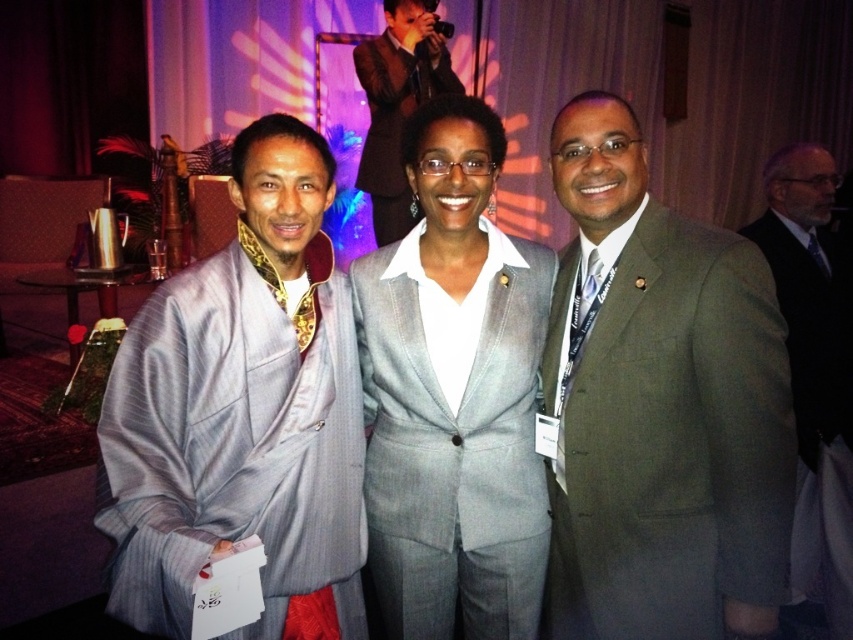
Question: Does silky gray robe at center have a lesser width compared to black wool suit at right?

Choices:
 (A) no
 (B) yes

Answer: (B)

Question: Which point is farther to the camera?

Choices:
 (A) matte olive green suit at center
 (B) silky gray robe at center

Answer: (A)

Question: In this image, where is brown textured suit at upper center located relative to silky blue tie at right?

Choices:
 (A) left
 (B) right

Answer: (A)

Question: Which is farther from the black wool suit at right?

Choices:
 (A) black silk tie at right
 (B) gray fabric suit at center
 (C) matte olive green suit at center
 (D) silky blue tie at right

Answer: (B)

Question: Among these objects, which one is nearest to the camera?

Choices:
 (A) black silk tie at right
 (B) matte olive green suit at center
 (C) silky blue tie at right
 (D) brown textured suit at upper center

Answer: (B)

Question: Is matte olive green suit at center below silky gray robe at center?

Choices:
 (A) yes
 (B) no

Answer: (A)